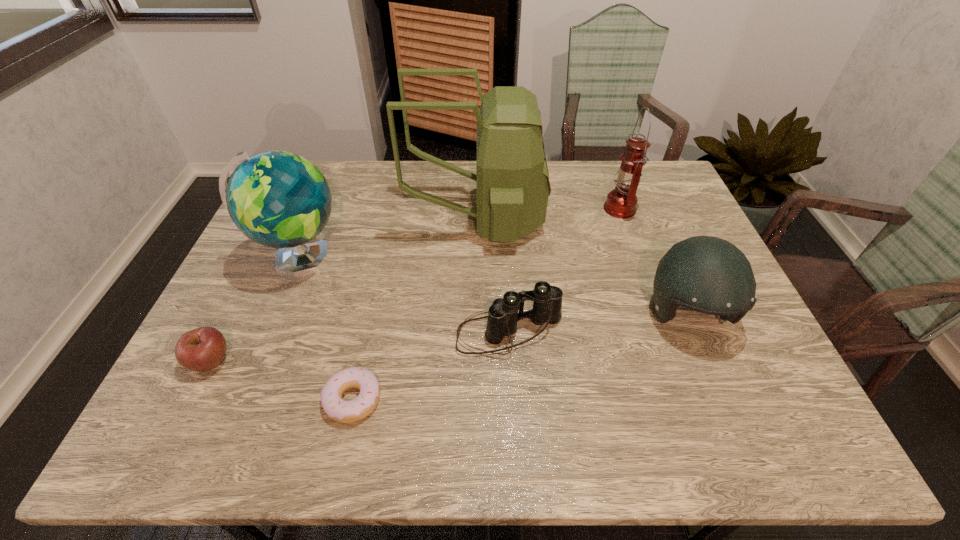
Locate an element on the screen. free space located at the face opening of the football helmet is located at coordinates (733, 426).

Find the location of `vacant region located on the front of the binoculars`. vacant region located on the front of the binoculars is located at coordinates (513, 379).

Where is `blank space located on the side of the second shortest object with the unique marking`? This screenshot has width=960, height=540. blank space located on the side of the second shortest object with the unique marking is located at coordinates (353, 361).

Find the location of a particular element. vacant space located on the left of the shortest object is located at coordinates (266, 400).

In order to click on backpack situated at the far edge in this screenshot , I will do `click(512, 179)`.

Where is `oil lamp located in the far edge section of the desktop`? The width and height of the screenshot is (960, 540). oil lamp located in the far edge section of the desktop is located at coordinates (621, 202).

Find the location of a particular element. The height and width of the screenshot is (540, 960). object present at the near edge is located at coordinates (336, 408).

The image size is (960, 540). What are the coordinates of `globe at the left edge` in the screenshot? It's located at (279, 199).

Locate an element on the screen. The width and height of the screenshot is (960, 540). apple that is at the left edge is located at coordinates (202, 349).

At what (x,y) coordinates should I click in order to perform the action: click on oil lamp at the right edge. Please return your answer as a coordinate pair (x, y). The width and height of the screenshot is (960, 540). Looking at the image, I should click on (621, 202).